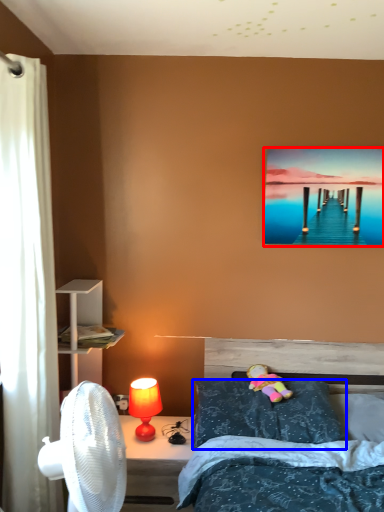
Question: Which object is closer to the camera taking this photo, picture frame (highlighted by a red box) or pillow (highlighted by a blue box)?

Choices:
 (A) picture frame
 (B) pillow

Answer: (B)